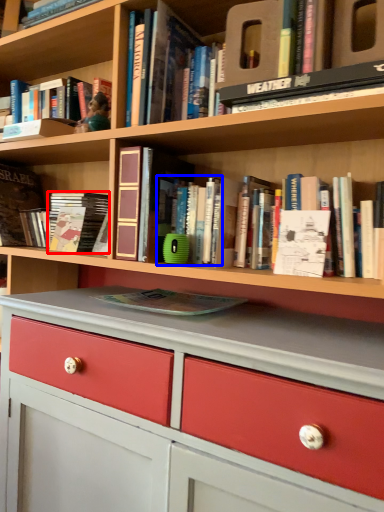
Question: Which object appears farthest to the camera in this image, book (highlighted by a red box) or book (highlighted by a blue box)?

Choices:
 (A) book
 (B) book

Answer: (A)